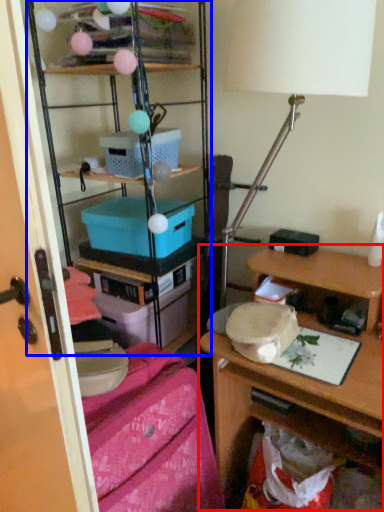
Question: Which object is further to the camera taking this photo, desk (highlighted by a red box) or shelf (highlighted by a blue box)?

Choices:
 (A) desk
 (B) shelf

Answer: (B)